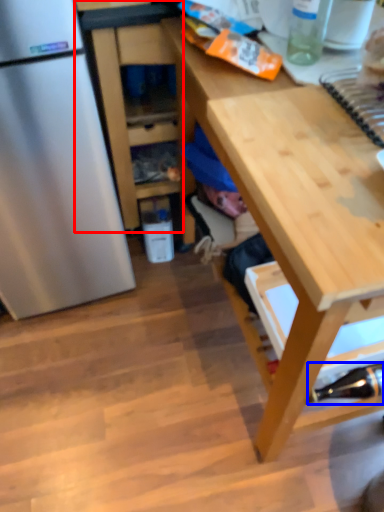
Question: Which object is closer to the camera taking this photo, cabinetry (highlighted by a red box) or bottle (highlighted by a blue box)?

Choices:
 (A) cabinetry
 (B) bottle

Answer: (B)